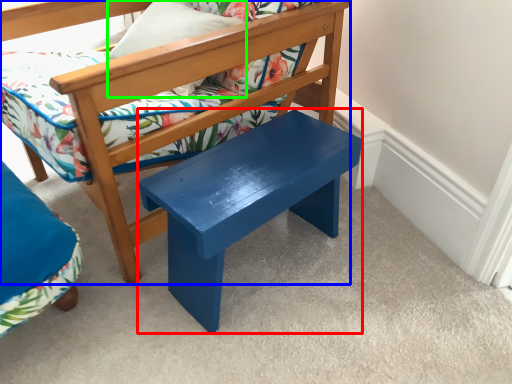
Question: Which object is positioned farthest from stool (highlighted by a red box)? Select from chair (highlighted by a blue box) and pillow (highlighted by a green box).

Choices:
 (A) chair
 (B) pillow

Answer: (B)